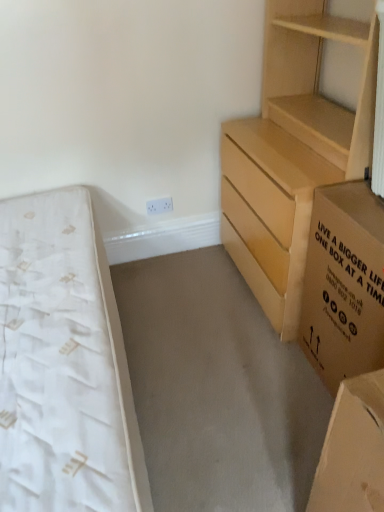
This screenshot has height=512, width=384. Identify the location of brown cardboard box at right. (344, 283).

Image resolution: width=384 pixels, height=512 pixels. What do you see at coordinates (292, 152) in the screenshot? I see `light brown wooden chest of drawers at right` at bounding box center [292, 152].

The width and height of the screenshot is (384, 512). I want to click on white textured mattress at left, so click(x=63, y=365).

This screenshot has width=384, height=512. Identify the location of brown cardboard box at right. (344, 283).

Is brown cardboard box at right far away from light brown wooden chest of drawers at right?

brown cardboard box at right is actually quite close to light brown wooden chest of drawers at right.

Considering the positions of objects brown cardboard box at right and light brown wooden chest of drawers at right in the image provided, who is more to the right, brown cardboard box at right or light brown wooden chest of drawers at right?

From the viewer's perspective, brown cardboard box at right appears more on the right side.

Consider the image. From a real-world perspective, is brown cardboard box at right above or below light brown wooden chest of drawers at right?

From a real-world perspective, brown cardboard box at right is physically below light brown wooden chest of drawers at right.

Consider the image. Is brown cardboard box at right looking in the opposite direction of light brown wooden chest of drawers at right?

No, light brown wooden chest of drawers at right is not at the back of brown cardboard box at right.

Choose the correct answer: Is light brown wooden chest of drawers at right inside white textured mattress at left or outside it?

light brown wooden chest of drawers at right is located beyond the bounds of white textured mattress at left.

Which is more to the left, light brown wooden chest of drawers at right or white textured mattress at left?

white textured mattress at left.

Is light brown wooden chest of drawers at right in front of white textured mattress at left?

No, it is not.

Between light brown wooden chest of drawers at right and white textured mattress at left, which one has smaller size?

white textured mattress at left.

Is brown cardboard box at right not within white textured mattress at left?

Yes, brown cardboard box at right is not within white textured mattress at left.

Is the position of brown cardboard box at right less distant than that of white textured mattress at left?

No.

From a real-world perspective, is brown cardboard box at right on white textured mattress at left?

Indeed, from a real-world perspective, brown cardboard box at right stands above white textured mattress at left.

Is light brown wooden chest of drawers at right aimed at brown cardboard box at right?

No, light brown wooden chest of drawers at right is not oriented towards brown cardboard box at right.

Which is in front, light brown wooden chest of drawers at right or brown cardboard box at right?

brown cardboard box at right is closer to the camera.

Does light brown wooden chest of drawers at right have a greater height compared to brown cardboard box at right?

Correct, light brown wooden chest of drawers at right is much taller as brown cardboard box at right.

Would you say light brown wooden chest of drawers at right is inside or outside brown cardboard box at right?

The correct answer is: outside.

Is point (90, 204) positioned before point (264, 183)?

No, (90, 204) is further to viewer.

From a real-world perspective, between white textured mattress at left and light brown wooden chest of drawers at right, who is vertically lower?

white textured mattress at left, from a real-world perspective.

Considering the relative sizes of white textured mattress at left and light brown wooden chest of drawers at right in the image provided, is white textured mattress at left bigger than light brown wooden chest of drawers at right?

No.

From the image's perspective, which is above, white textured mattress at left or light brown wooden chest of drawers at right?

From the image's view, light brown wooden chest of drawers at right is above.

Is white textured mattress at left far from brown cardboard box at right?

No.

Do you think white textured mattress at left is within brown cardboard box at right, or outside of it?

white textured mattress at left cannot be found inside brown cardboard box at right.

In the image, is white textured mattress at left on the left side or the right side of brown cardboard box at right?

From the image, it's evident that white textured mattress at left is to the left of brown cardboard box at right.

I want to click on cardboard box that is in front of the light brown wooden chest of drawers at right, so point(344,283).

Where is `chest of drawers above the white textured mattress at left (from the image's perspective)`? chest of drawers above the white textured mattress at left (from the image's perspective) is located at coordinates (292, 152).

Based on their spatial positions, is brown cardboard box at right or white textured mattress at left closer to light brown wooden chest of drawers at right?

brown cardboard box at right lies closer to light brown wooden chest of drawers at right than the other object.

From the image, which object appears to be nearer to brown cardboard box at right, white textured mattress at left or light brown wooden chest of drawers at right?

Among the two, light brown wooden chest of drawers at right is located nearer to brown cardboard box at right.

Which object lies further to the anchor point white textured mattress at left, light brown wooden chest of drawers at right or brown cardboard box at right?

Based on the image, light brown wooden chest of drawers at right appears to be further to white textured mattress at left.

Based on their spatial positions, is light brown wooden chest of drawers at right or white textured mattress at left further from brown cardboard box at right?

white textured mattress at left lies further to brown cardboard box at right than the other object.

From the image, which object appears to be nearer to light brown wooden chest of drawers at right, white textured mattress at left or brown cardboard box at right?

brown cardboard box at right is closer to light brown wooden chest of drawers at right.

When comparing their distances from white textured mattress at left, does brown cardboard box at right or light brown wooden chest of drawers at right seem further?

light brown wooden chest of drawers at right is further to white textured mattress at left.

Find the location of a particular element. The width and height of the screenshot is (384, 512). chest of drawers between white textured mattress at left and brown cardboard box at right from left to right is located at coordinates (292, 152).